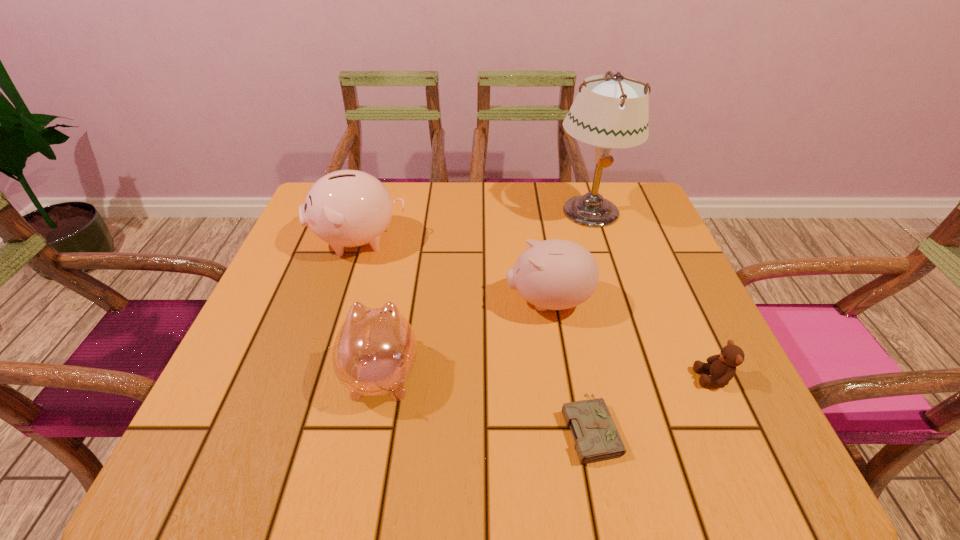
You are a GUI agent. You are given a task and a screenshot of the screen. Output one action in this format:
    pyautogui.click(x=<x>, y=<y>)
    Task: Click on the lampshade at the far edge
    The image size is (960, 540).
    Given the screenshot: What is the action you would take?
    pyautogui.click(x=614, y=114)

Where is `piggy bank located at the far edge`? piggy bank located at the far edge is located at coordinates (347, 208).

Image resolution: width=960 pixels, height=540 pixels. What are the coordinates of `object that is at the near edge` in the screenshot? It's located at (596, 437).

This screenshot has width=960, height=540. I want to click on object situated at the left edge, so click(x=347, y=208).

This screenshot has width=960, height=540. Find the location of `lampshade at the right edge`. lampshade at the right edge is located at coordinates (614, 114).

The height and width of the screenshot is (540, 960). What are the coordinates of `teddy bear that is positioned at the right edge` in the screenshot? It's located at (722, 367).

Where is `object that is at the far left corner`? object that is at the far left corner is located at coordinates 347,208.

Where is `object that is at the far right corner`? This screenshot has width=960, height=540. object that is at the far right corner is located at coordinates (614, 114).

This screenshot has width=960, height=540. Identify the location of free space at the far edge of the desktop. (408, 205).

Where is `vacant area at the near edge of the desktop`? vacant area at the near edge of the desktop is located at coordinates (497, 457).